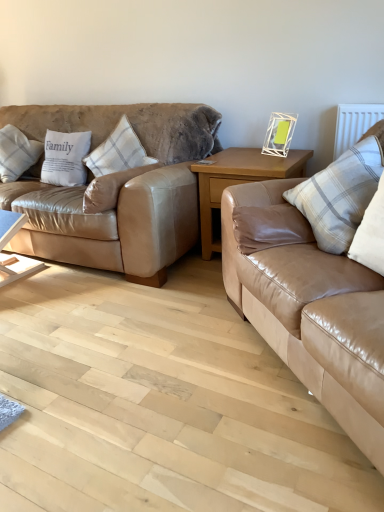
In order to face white plastic picture frame at upper right, should I rotate leftwards or rightwards?

Turn right approximately 11.738 degrees to face it.

The height and width of the screenshot is (512, 384). Describe the element at coordinates (308, 306) in the screenshot. I see `tan leather couch at right, marked as the 2th studio couch in a left-to-right arrangement` at that location.

The height and width of the screenshot is (512, 384). Find the location of `light brown wooden table at center, placed as the 2th table when sorted from left to right`. light brown wooden table at center, placed as the 2th table when sorted from left to right is located at coordinates pyautogui.click(x=239, y=180).

The width and height of the screenshot is (384, 512). What do you see at coordinates (341, 193) in the screenshot?
I see `plaid fabric pillow at right, positioned as the 5th pillow in left-to-right order` at bounding box center [341, 193].

What is the approximate height of white plaid pillow at left, placed as the first pillow when sorted from left to right?

15.52 inches.

This screenshot has width=384, height=512. I want to click on white plaid pillow at left, which is counted as the third pillow, starting from the right, so click(118, 151).

Identify the location of white plastic picture frame at upper right. (279, 134).

Is tan leather couch at right, the first studio couch positioned from the right, completely or partially outside of white plaid pillow at left, the 4th pillow in the left-to-right sequence?

tan leather couch at right, the first studio couch positioned from the right, lies outside white plaid pillow at left, the 4th pillow in the left-to-right sequence,'s area.

Considering the relative sizes of tan leather couch at right, marked as the 2th studio couch in a left-to-right arrangement, and white plaid pillow at left, the 4th pillow in the left-to-right sequence, in the image provided, is tan leather couch at right, marked as the 2th studio couch in a left-to-right arrangement, bigger than white plaid pillow at left, the 4th pillow in the left-to-right sequence,?

Indeed, tan leather couch at right, marked as the 2th studio couch in a left-to-right arrangement, has a larger size compared to white plaid pillow at left, the 4th pillow in the left-to-right sequence.

From a real-world perspective, is tan leather couch at right, the first studio couch positioned from the right, located higher than white plaid pillow at left, the 4th pillow in the left-to-right sequence?

No.

Which is more distant, (x=352, y=407) or (x=116, y=184)?

The point (x=116, y=184) is farther from the camera.

Is the depth of plaid fabric pillow at right, positioned as the 5th pillow in left-to-right order, less than that of white plaid pillow at left, positioned as the 5th pillow in right-to-left order?

Yes, the depth of plaid fabric pillow at right, positioned as the 5th pillow in left-to-right order, is less than that of white plaid pillow at left, positioned as the 5th pillow in right-to-left order.

Is plaid fabric pillow at right, which is the first pillow in right-to-left order, far from white plaid pillow at left, placed as the first pillow when sorted from left to right?

Yes.

Is point (323, 191) in front of point (3, 169)?

Yes, it is in front of point (3, 169).

Considering the relative sizes of plaid fabric pillow at right, positioned as the 5th pillow in left-to-right order, and white plaid pillow at left, placed as the first pillow when sorted from left to right, in the image provided, is plaid fabric pillow at right, positioned as the 5th pillow in left-to-right order, wider than white plaid pillow at left, placed as the first pillow when sorted from left to right,?

No, plaid fabric pillow at right, positioned as the 5th pillow in left-to-right order, is not wider than white plaid pillow at left, placed as the first pillow when sorted from left to right.

Is white textured radiator at upper right a part of white plaid pillow at left, positioned as the second pillow in right-to-left order?

No, white plaid pillow at left, positioned as the second pillow in right-to-left order, does not contain white textured radiator at upper right.

How many degrees apart are the facing directions of white plaid pillow at left, the 4th pillow in the left-to-right sequence, and white textured radiator at upper right?

The angle between the facing direction of white plaid pillow at left, the 4th pillow in the left-to-right sequence, and the facing direction of white textured radiator at upper right is 90.6 degrees.

At what (x,y) coordinates should I click in order to perform the action: click on pillow that is the 5th object directly below the white textured radiator at upper right (from a real-world perspective). Please return your answer as a coordinate pair (x, y). Image resolution: width=384 pixels, height=512 pixels. Looking at the image, I should click on (111, 188).

Would you consider white plaid pillow at left, positioned as the second pillow in right-to-left order, to be distant from white textured radiator at upper right?

Yes.

Considering the sizes of objects white textured radiator at upper right and matte leather couch at left, the 2th studio couch in the right-to-left sequence, in the image provided, who is wider, white textured radiator at upper right or matte leather couch at left, the 2th studio couch in the right-to-left sequence,?

matte leather couch at left, the 2th studio couch in the right-to-left sequence, is wider.

Based on their sizes in the image, would you say white textured radiator at upper right is bigger or smaller than matte leather couch at left, which is the first studio couch from left to right?

Considering their sizes, white textured radiator at upper right takes up less space than matte leather couch at left, which is the first studio couch from left to right.

Does white textured radiator at upper right have a greater height compared to matte leather couch at left, which is the first studio couch from left to right?

Incorrect, the height of white textured radiator at upper right is not larger of that of matte leather couch at left, which is the first studio couch from left to right.

Consider the image. Is white textured radiator at upper right oriented towards matte leather couch at left, which is the first studio couch from left to right?

No.

From a real-world perspective, between white plaid pillow at left, positioned as the 5th pillow in right-to-left order, and matte leather couch at left, which is the first studio couch from left to right, who is vertically higher?

From a 3D spatial view, white plaid pillow at left, positioned as the 5th pillow in right-to-left order, is above.

From the picture: Is white plaid pillow at left, positioned as the 5th pillow in right-to-left order, turned away from matte leather couch at left, the 2th studio couch in the right-to-left sequence?

Absolutely, white plaid pillow at left, positioned as the 5th pillow in right-to-left order, is directed away from matte leather couch at left, the 2th studio couch in the right-to-left sequence.

Considering the sizes of objects white plaid pillow at left, placed as the first pillow when sorted from left to right, and matte leather couch at left, which is the first studio couch from left to right, in the image provided, who is shorter, white plaid pillow at left, placed as the first pillow when sorted from left to right, or matte leather couch at left, which is the first studio couch from left to right,?

Standing shorter between the two is white plaid pillow at left, placed as the first pillow when sorted from left to right.

Visually, is white textured radiator at upper right positioned to the left or to the right of light wood table at lower left, positioned as the 1th table in left-to-right order?

In the image, white textured radiator at upper right appears on the right side of light wood table at lower left, positioned as the 1th table in left-to-right order.

From the image's perspective, is white textured radiator at upper right over light wood table at lower left, which ranks as the 2th table in right-to-left order?

Yes, from the image's perspective, white textured radiator at upper right is above light wood table at lower left, which ranks as the 2th table in right-to-left order.

Are white textured radiator at upper right and light wood table at lower left, positioned as the 1th table in left-to-right order, located far from each other?

white textured radiator at upper right is far away from light wood table at lower left, positioned as the 1th table in left-to-right order.

Is white textured radiator at upper right oriented towards light wood table at lower left, positioned as the 1th table in left-to-right order?

No, white textured radiator at upper right does not turn towards light wood table at lower left, positioned as the 1th table in left-to-right order.

Does matte leather couch at left, the 2th studio couch in the right-to-left sequence, appear on the right side of white cotton pillow at left, arranged as the 4th pillow when viewed from the right?

Yes, matte leather couch at left, the 2th studio couch in the right-to-left sequence, is to the right of white cotton pillow at left, arranged as the 4th pillow when viewed from the right.

Are matte leather couch at left, which is the first studio couch from left to right, and white cotton pillow at left, arranged as the 4th pillow when viewed from the right, making contact?

No, matte leather couch at left, which is the first studio couch from left to right, is not beside white cotton pillow at left, arranged as the 4th pillow when viewed from the right.

Looking at this image, is matte leather couch at left, which is the first studio couch from left to right, facing towards white cotton pillow at left, arranged as the 4th pillow when viewed from the right?

Yes, matte leather couch at left, which is the first studio couch from left to right, is oriented towards white cotton pillow at left, arranged as the 4th pillow when viewed from the right.

Does matte leather couch at left, which is the first studio couch from left to right, have a greater width compared to white cotton pillow at left, arranged as the 4th pillow when viewed from the right?

Correct, the width of matte leather couch at left, which is the first studio couch from left to right, exceeds that of white cotton pillow at left, arranged as the 4th pillow when viewed from the right.

Where is `the 2nd pillow behind the tan leather couch at right, the first studio couch positioned from the right`? The height and width of the screenshot is (512, 384). the 2nd pillow behind the tan leather couch at right, the first studio couch positioned from the right is located at coordinates (111, 188).

From the image's perspective, which pillow is the 4th one above the plaid fabric pillow at right, positioned as the 5th pillow in left-to-right order? Please provide its 2D coordinates.

[(17, 153)]

Estimate the real-world distances between objects in this image. Which object is closer to white textured radiator at upper right, light wood table at lower left, which ranks as the 2th table in right-to-left order, or plaid fabric pillow at right, which is the first pillow in right-to-left order?

plaid fabric pillow at right, which is the first pillow in right-to-left order, is positioned closer to the anchor white textured radiator at upper right.

Based on their spatial positions, is plaid fabric pillow at right, positioned as the 5th pillow in left-to-right order, or tan leather couch at right, marked as the 2th studio couch in a left-to-right arrangement, closer to white plastic picture frame at upper right?

Based on the image, plaid fabric pillow at right, positioned as the 5th pillow in left-to-right order, appears to be nearer to white plastic picture frame at upper right.

Considering their positions, is white plaid pillow at left, the 4th pillow in the left-to-right sequence, positioned closer to light wood table at lower left, which ranks as the 2th table in right-to-left order, than white plaid pillow at left, the 3th pillow viewed from the left?

Among the two, white plaid pillow at left, the 4th pillow in the left-to-right sequence, is located nearer to light wood table at lower left, which ranks as the 2th table in right-to-left order.

Based on their spatial positions, is plaid fabric pillow at right, positioned as the 5th pillow in left-to-right order, or tan leather couch at right, marked as the 2th studio couch in a left-to-right arrangement, further from white plaid pillow at left, the 4th pillow in the left-to-right sequence?

Among the two, plaid fabric pillow at right, positioned as the 5th pillow in left-to-right order, is located further to white plaid pillow at left, the 4th pillow in the left-to-right sequence.

Which object lies further to the anchor point light wood table at lower left, which ranks as the 2th table in right-to-left order, tan leather couch at right, the first studio couch positioned from the right, or white textured radiator at upper right?

Based on the image, white textured radiator at upper right appears to be further to light wood table at lower left, which ranks as the 2th table in right-to-left order.

From the image, which object appears to be nearer to white plastic picture frame at upper right, white plaid pillow at left, the 4th pillow in the left-to-right sequence, or matte leather couch at left, which is the first studio couch from left to right?

white plaid pillow at left, the 4th pillow in the left-to-right sequence, is closer to white plastic picture frame at upper right.

Estimate the real-world distances between objects in this image. Which object is closer to matte leather couch at left, which is the first studio couch from left to right, white textured radiator at upper right or light brown wooden table at center, placed as the 2th table when sorted from left to right?

light brown wooden table at center, placed as the 2th table when sorted from left to right.

When comparing their distances from white plaid pillow at left, placed as the first pillow when sorted from left to right, does white plaid pillow at left, the 3th pillow viewed from the left, or light brown wooden table at center, marked as the 1th table in a right-to-left arrangement, seem closer?

Among the two, white plaid pillow at left, the 3th pillow viewed from the left, is located nearer to white plaid pillow at left, placed as the first pillow when sorted from left to right.

At what (x,y) coordinates should I click in order to perform the action: click on table situated between white plaid pillow at left, the 3th pillow viewed from the left, and white plastic picture frame at upper right from left to right. Please return your answer as a coordinate pair (x, y). The height and width of the screenshot is (512, 384). Looking at the image, I should click on (239, 180).

Find the location of `table between white plaid pillow at left, positioned as the 5th pillow in right-to-left order, and light brown wooden table at center, marked as the 1th table in a right-to-left arrangement, from left to right`. table between white plaid pillow at left, positioned as the 5th pillow in right-to-left order, and light brown wooden table at center, marked as the 1th table in a right-to-left arrangement, from left to right is located at coordinates (13, 254).

You are a GUI agent. You are given a task and a screenshot of the screen. Output one action in this format:
    pyautogui.click(x=<x>, y=<y>)
    Task: Click on the table positioned between plaid fabric pillow at right, which is the first pillow in right-to-left order, and white textured radiator at upper right from near to far
    This screenshot has height=512, width=384.
    Given the screenshot: What is the action you would take?
    pyautogui.click(x=239, y=180)

Find the location of a particular element. This screenshot has width=384, height=512. studio couch between light wood table at lower left, which ranks as the 2th table in right-to-left order, and white plaid pillow at left, the 4th pillow in the left-to-right sequence, in the horizontal direction is located at coordinates (117, 190).